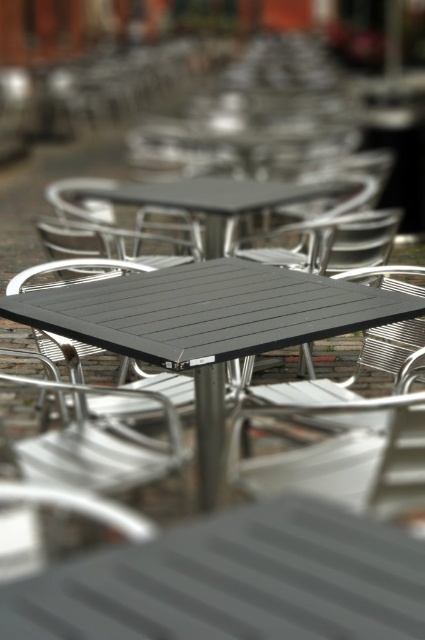
You are standing at the entrance of the outdoor seating area and want to walk towards the point marked as point (121, 324). As you walk, you notice another point labeled point (116, 186). Which point will you encounter first?

You will encounter point (116, 186) first because it is behind point (121, 324), so you must pass point (121, 324) first before reaching point (116, 186). Wait, this seems contradictory. Let me check the description again. The Objects Description says point (121, 324) is in front of point (116, 186). That means point 0.508 is closer to the observer. So when moving towards point 0.508, you would reach it first. But the question asks which point you encounter first while walking towards point 0.50

You are standing in the outdoor seating area of a cafe and want to take a photo of the point at coordinates point (319, 305). If your camera has a focal length of 50mm and you want to ensure the point is in focus, what is the minimum distance you need to be from the point to capture it clearly?

The point at coordinates point (319, 305) is 6.91 feet from the camera, so the minimum distance required to capture it clearly is 6.91 feet.

You are a customer looking for a table to sit at in the outdoor seating area. You see a black plastic table at center and a matte black table at center. Which table is positioned to the right side of the other?

The black plastic table at center is to the right of the matte black table at center.